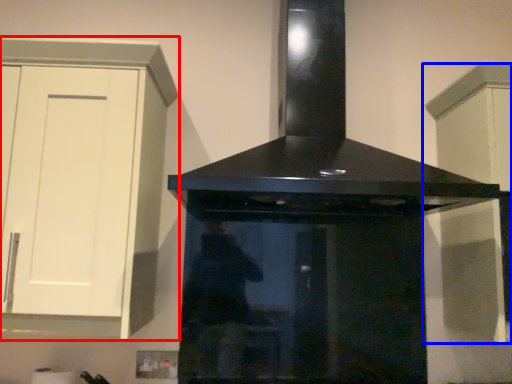
Question: Which object is closer to the camera taking this photo, cabinetry (highlighted by a red box) or cabinetry (highlighted by a blue box)?

Choices:
 (A) cabinetry
 (B) cabinetry

Answer: (A)